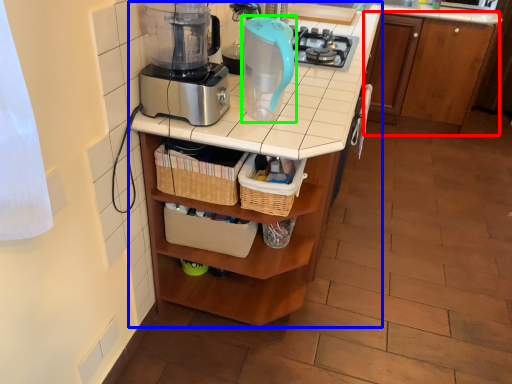
Question: Which object is positioned farthest from cabinetry (highlighted by a red box)? Select from table (highlighted by a blue box) and kitchen appliance (highlighted by a green box).

Choices:
 (A) table
 (B) kitchen appliance

Answer: (B)